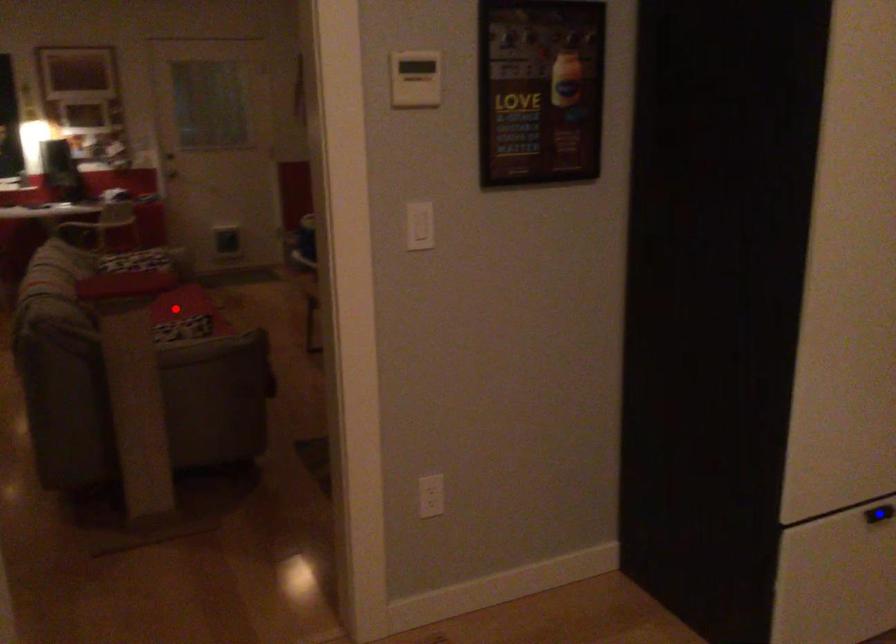
Question: In the image, two points are highlighted. Which point is nearer to the camera? Reply with the corresponding letter.

Choices:
 (A) blue point
 (B) red point

Answer: (A)